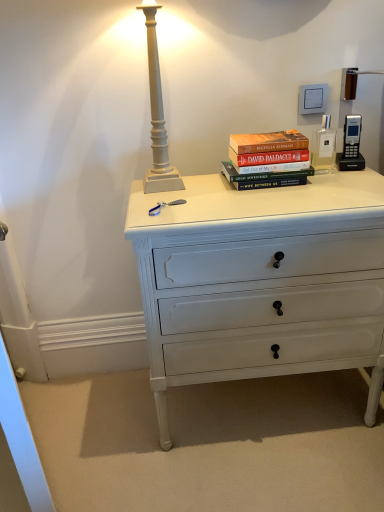
Identify the location of empty space that is to the right of hardcover books at center. The width and height of the screenshot is (384, 512). (345, 178).